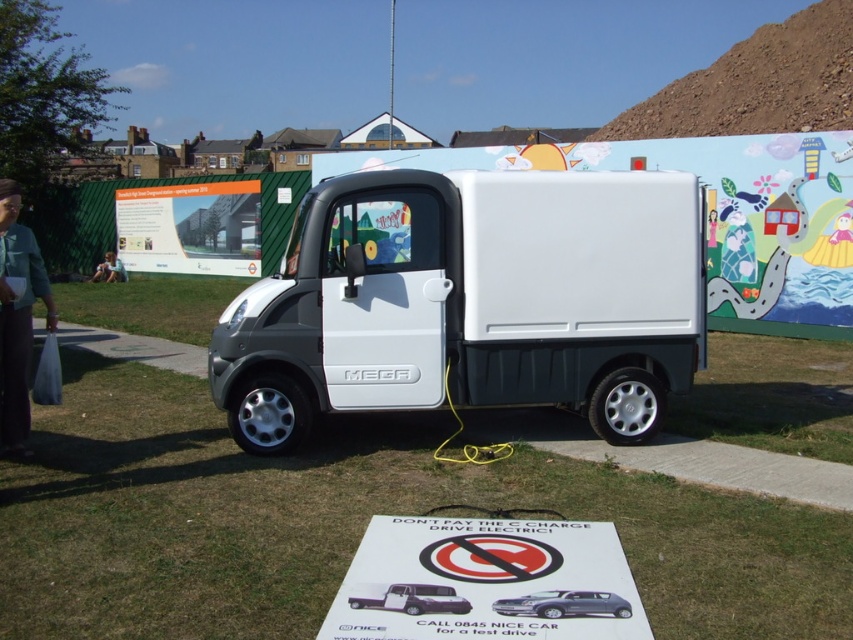
Is white matte truck at center closer to the viewer compared to satin silver car at center?

No, white matte truck at center is further to the viewer.

Between point (314, 216) and point (547, 614), which one is positioned in front?

Point (547, 614) is more forward.

Identify the location of white matte truck at center. This screenshot has height=640, width=853. (471, 301).

Does metallic silver car at center have a larger size compared to light brown fabric jacket at lower left?

No, metallic silver car at center is not bigger than light brown fabric jacket at lower left.

What are the coordinates of `metallic silver car at center` in the screenshot? It's located at (415, 600).

Where is `metallic silver car at center`? metallic silver car at center is located at coordinates (415, 600).

Is white paper sign at center taller than denim jacket at left?

In fact, white paper sign at center may be shorter than denim jacket at left.

Looking at this image, can you confirm if white paper sign at center is positioned above denim jacket at left?

Actually, white paper sign at center is below denim jacket at left.

The image size is (853, 640). What do you see at coordinates (486, 580) in the screenshot?
I see `white paper sign at center` at bounding box center [486, 580].

What are the coordinates of `white paper sign at center` in the screenshot? It's located at (486, 580).